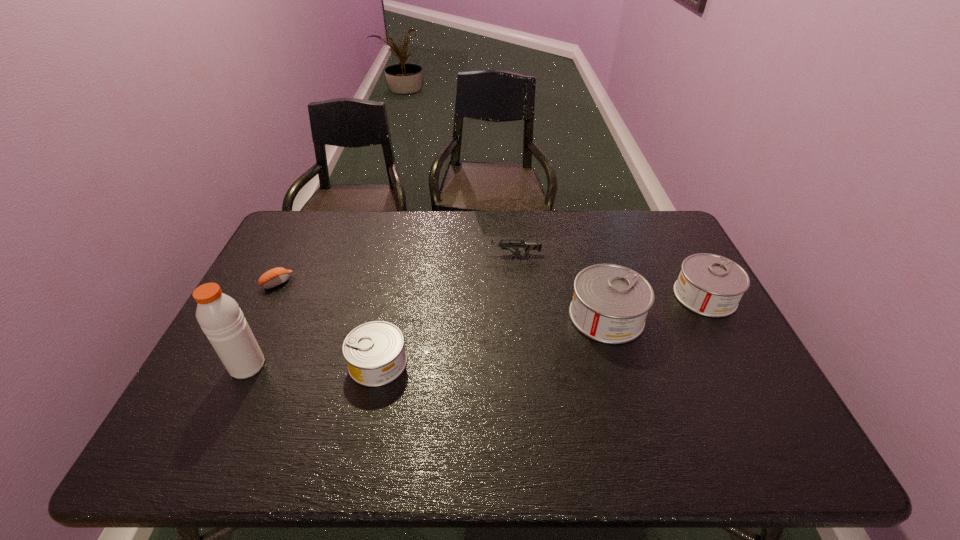
Where is `unoccupied position between the tallest object and the farthest object`? The image size is (960, 540). unoccupied position between the tallest object and the farthest object is located at coordinates (380, 309).

Where is `free space between the tallest object and the third tallest object`? This screenshot has height=540, width=960. free space between the tallest object and the third tallest object is located at coordinates (476, 330).

I want to click on free space that is in between the gun and the sushi, so click(395, 268).

The height and width of the screenshot is (540, 960). Find the location of `blank region between the gun and the second object from right to left`. blank region between the gun and the second object from right to left is located at coordinates (560, 285).

In order to click on unoccupied area between the shaker and the fifth object from left to right in this screenshot , I will do `click(427, 341)`.

This screenshot has height=540, width=960. What are the coordinates of `the second closest object relative to the leftmost can` in the screenshot? It's located at (276, 276).

I want to click on object that stands as the fourth closest to the third object from left to right, so click(610, 303).

At what (x,y) coordinates should I click in order to perform the action: click on can that is the nearest to the third object from right to left. Please return your answer as a coordinate pair (x, y). The height and width of the screenshot is (540, 960). Looking at the image, I should click on (610, 303).

Find the location of a particular element. The image size is (960, 540). can that is the second closest to the fourth shortest object is located at coordinates (374, 351).

Find the location of a particular element. vacant space that satisfies the following two spatial constraints: 1. aimed along the barrel of the fifth tallest object; 2. on the front side of the shaker is located at coordinates (522, 366).